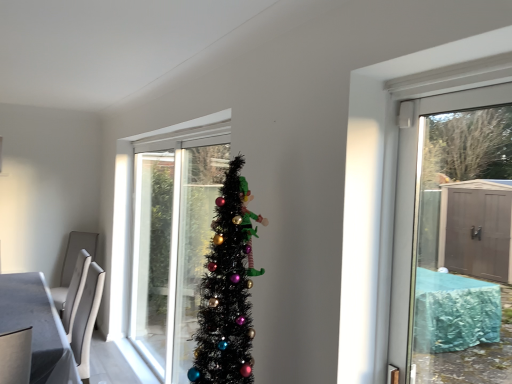
Question: Considering the relative sizes of transparent glass door at upper right and white glossy table at lower left in the image provided, is transparent glass door at upper right shorter than white glossy table at lower left?

Choices:
 (A) yes
 (B) no

Answer: (B)

Question: Does transparent glass door at upper right have a greater width compared to white glossy table at lower left?

Choices:
 (A) yes
 (B) no

Answer: (B)

Question: From a real-world perspective, is transparent glass door at upper right on top of white glossy table at lower left?

Choices:
 (A) no
 (B) yes

Answer: (B)

Question: Does transparent glass door at upper right touch white glossy table at lower left?

Choices:
 (A) no
 (B) yes

Answer: (A)

Question: Is transparent glass door at upper right positioned beyond the bounds of white glossy table at lower left?

Choices:
 (A) yes
 (B) no

Answer: (A)

Question: Does transparent glass door at upper right have a greater height compared to white glossy table at lower left?

Choices:
 (A) no
 (B) yes

Answer: (B)

Question: Does white glossy table at lower left have a lesser height compared to transparent glass door at upper right?

Choices:
 (A) no
 (B) yes

Answer: (B)

Question: Is white glossy table at lower left taller than transparent glass door at upper right?

Choices:
 (A) yes
 (B) no

Answer: (B)

Question: Does white glossy table at lower left turn towards transparent glass door at upper right?

Choices:
 (A) no
 (B) yes

Answer: (A)

Question: Can you confirm if white glossy table at lower left is positioned to the left of transparent glass door at upper right?

Choices:
 (A) yes
 (B) no

Answer: (A)

Question: Is the surface of white glossy table at lower left in direct contact with transparent glass door at upper right?

Choices:
 (A) yes
 (B) no

Answer: (B)

Question: From the image's perspective, is white glossy table at lower left on top of transparent glass door at upper right?

Choices:
 (A) no
 (B) yes

Answer: (A)

Question: From the image's perspective, is transparent glass door at upper right positioned above or below white glossy table at lower left?

Choices:
 (A) above
 (B) below

Answer: (A)